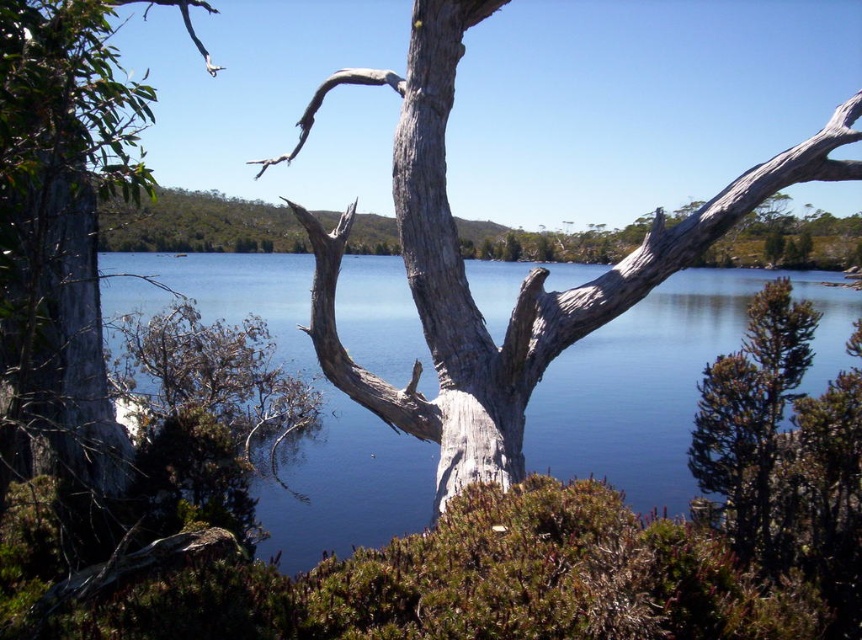
Is blue water at center shorter than gray rough bark tree at left?

Indeed, blue water at center has a lesser height compared to gray rough bark tree at left.

Between blue water at center and gray rough bark tree at left, which one has less height?

With less height is blue water at center.

Locate an element on the screen. This screenshot has height=640, width=862. blue water at center is located at coordinates (661, 380).